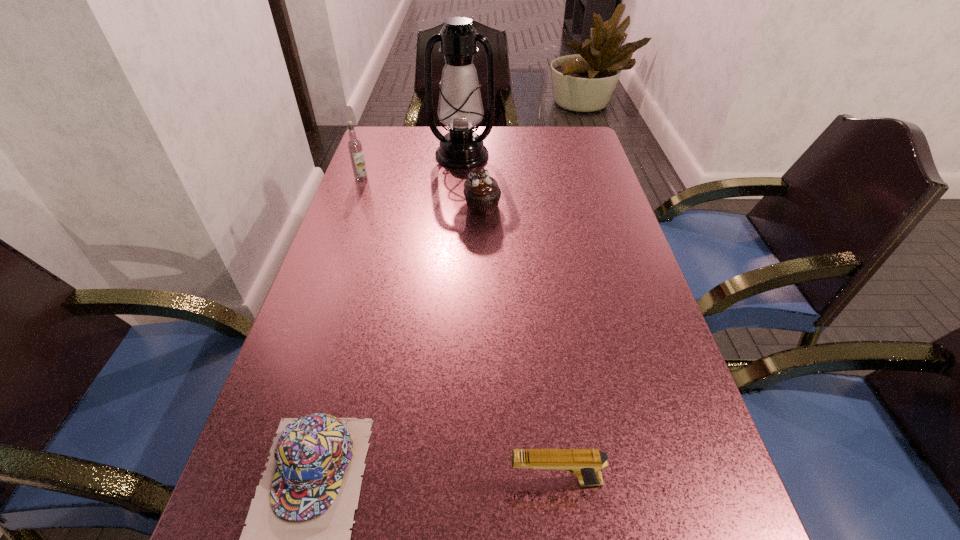
Image resolution: width=960 pixels, height=540 pixels. I want to click on free region located at the barrel of the pistol, so click(354, 481).

In order to click on vacant region located 0.250m at the barrel of the pistol in this screenshot , I will do `click(348, 481)`.

At what (x,y) coordinates should I click in order to perform the action: click on object present at the far edge. Please return your answer as a coordinate pair (x, y). This screenshot has height=540, width=960. Looking at the image, I should click on (460, 108).

You are a GUI agent. You are given a task and a screenshot of the screen. Output one action in this format:
    pyautogui.click(x=<x>, y=<y>)
    Task: Click on the object at the left edge
    This screenshot has height=540, width=960.
    Given the screenshot: What is the action you would take?
    pyautogui.click(x=354, y=145)

You are a GUI agent. You are given a task and a screenshot of the screen. Output one action in this format:
    pyautogui.click(x=<x>, y=<y>)
    Task: Click on the free space at the left edge
    
    Given the screenshot: What is the action you would take?
    pyautogui.click(x=296, y=361)

The height and width of the screenshot is (540, 960). I want to click on vacant point at the right edge, so click(676, 475).

What are the coordinates of `vacant point at the far left corner` in the screenshot? It's located at (405, 148).

The image size is (960, 540). I want to click on vacant area at the far right corner of the desktop, so [x=577, y=137].

Locate an element on the screen. free spot between the second tallest object and the cupcake is located at coordinates (422, 193).

Find the location of a particular element. empty space between the second farthest object and the cupcake is located at coordinates (422, 193).